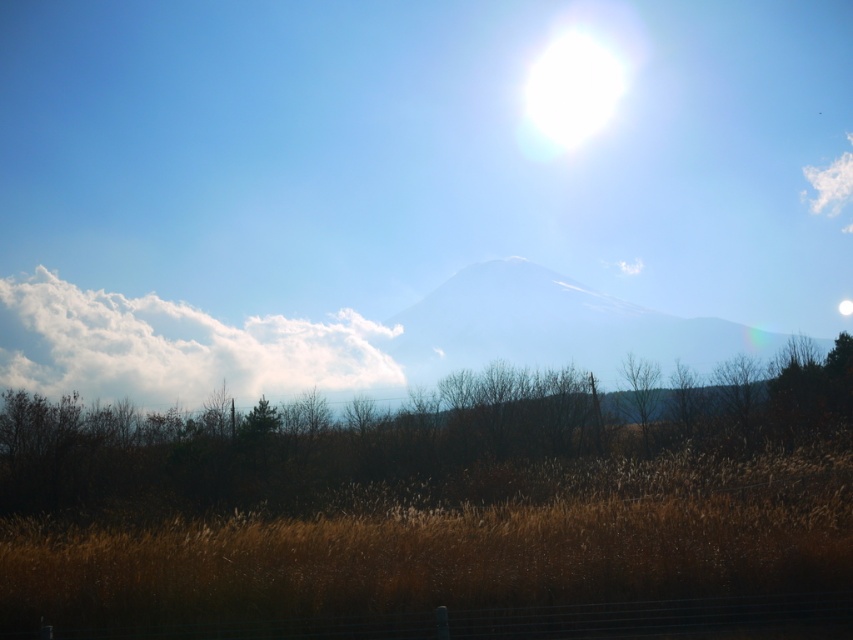
Does brown grass at lower center appear under white fluffy cloud at upper right?

Yes.

Measure the distance between brown grass at lower center and white fluffy cloud at upper right.

brown grass at lower center and white fluffy cloud at upper right are 59.07 meters apart from each other.

This screenshot has width=853, height=640. What do you see at coordinates (412, 440) in the screenshot?
I see `brown grass at lower center` at bounding box center [412, 440].

This screenshot has width=853, height=640. Find the location of `brown grass at lower center`. brown grass at lower center is located at coordinates 412,440.

Is bright white snow at center below brown dry grass at lower center?

No, bright white snow at center is not below brown dry grass at lower center.

Between bright white snow at center and brown dry grass at lower center, which one appears on the left side from the viewer's perspective?

From the viewer's perspective, bright white snow at center appears more on the left side.

Image resolution: width=853 pixels, height=640 pixels. What are the coordinates of `bright white snow at center` in the screenshot? It's located at (390, 179).

Where is `bright white snow at center`? This screenshot has width=853, height=640. bright white snow at center is located at coordinates (390, 179).

Can you confirm if white fluffy cloud at upper left is positioned to the left of white fluffy cloud at upper right?

Yes, white fluffy cloud at upper left is to the left of white fluffy cloud at upper right.

Is white fluffy cloud at upper left taller than white fluffy cloud at upper right?

Yes, white fluffy cloud at upper left is taller than white fluffy cloud at upper right.

Between point (363, 362) and point (842, 179), which one is positioned behind?

The point (842, 179) is more distant.

The image size is (853, 640). I want to click on white fluffy cloud at upper left, so (175, 348).